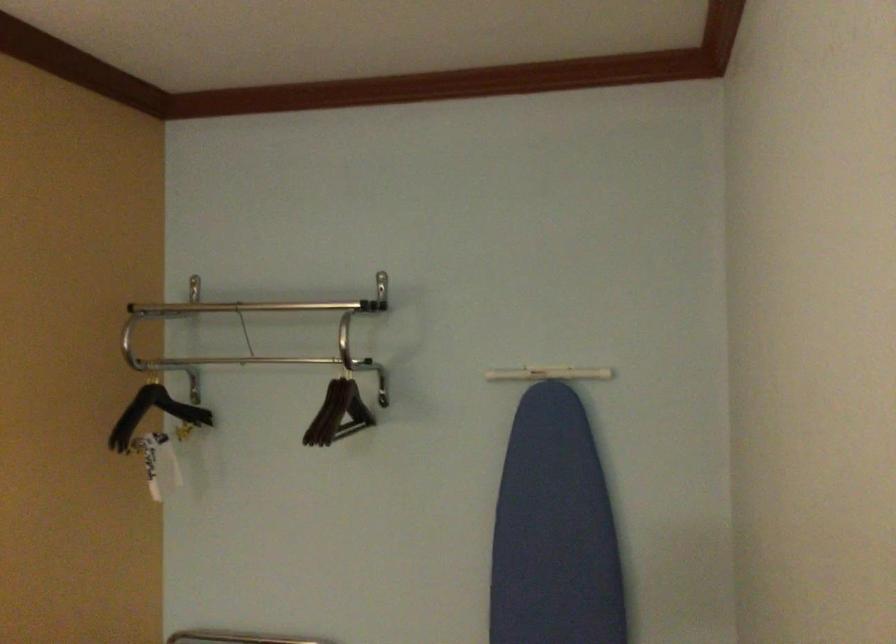
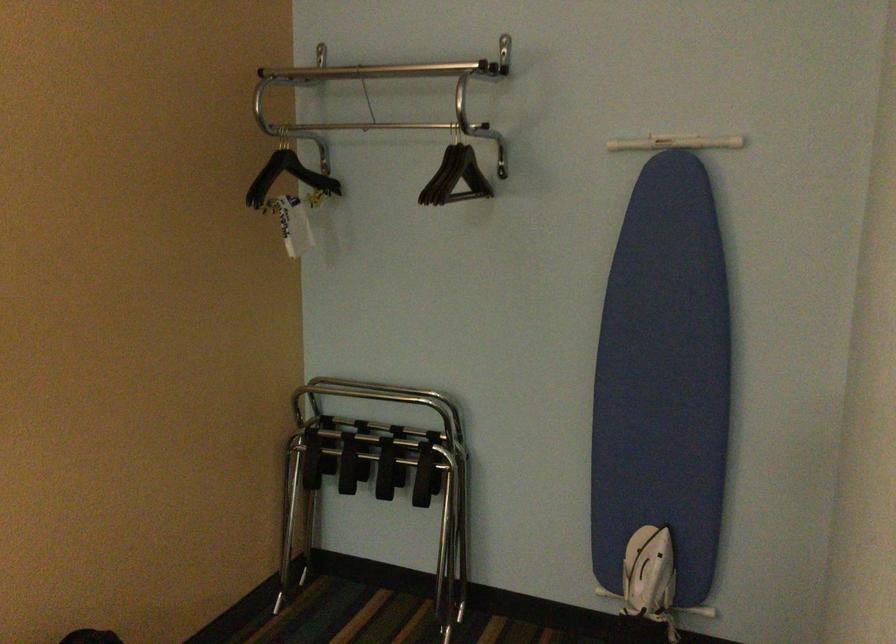
In the second image, find the point that corresponds to (x=156, y=408) in the first image.

(288, 176)